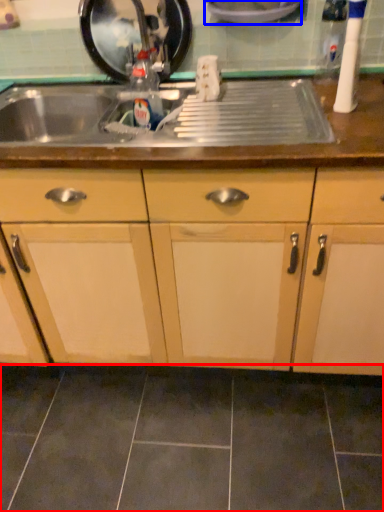
Question: Which object is further to the camera taking this photo, ceramic tile (highlighted by a red box) or appliance (highlighted by a blue box)?

Choices:
 (A) ceramic tile
 (B) appliance

Answer: (B)